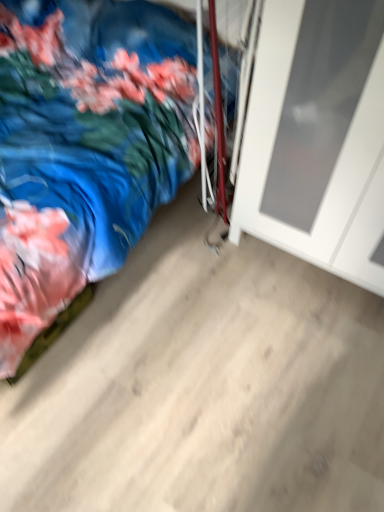
Question: Is white matte door at right taller or shorter than blue satin bed at lower left?

Choices:
 (A) tall
 (B) short

Answer: (A)

Question: Is white matte door at right bigger or smaller than blue satin bed at lower left?

Choices:
 (A) big
 (B) small

Answer: (B)

Question: Do you think white matte door at right is within blue satin bed at lower left, or outside of it?

Choices:
 (A) inside
 (B) outside

Answer: (B)

Question: Does point (112, 10) appear closer or farther from the camera than point (352, 271)?

Choices:
 (A) closer
 (B) farther

Answer: (B)

Question: Is blue satin bed at lower left spatially inside white matte door at right, or outside of it?

Choices:
 (A) outside
 (B) inside

Answer: (A)

Question: From the image's perspective, relative to white matte door at right, is blue satin bed at lower left above or below?

Choices:
 (A) below
 (B) above

Answer: (B)

Question: Is blue satin bed at lower left bigger or smaller than white matte door at right?

Choices:
 (A) big
 (B) small

Answer: (A)